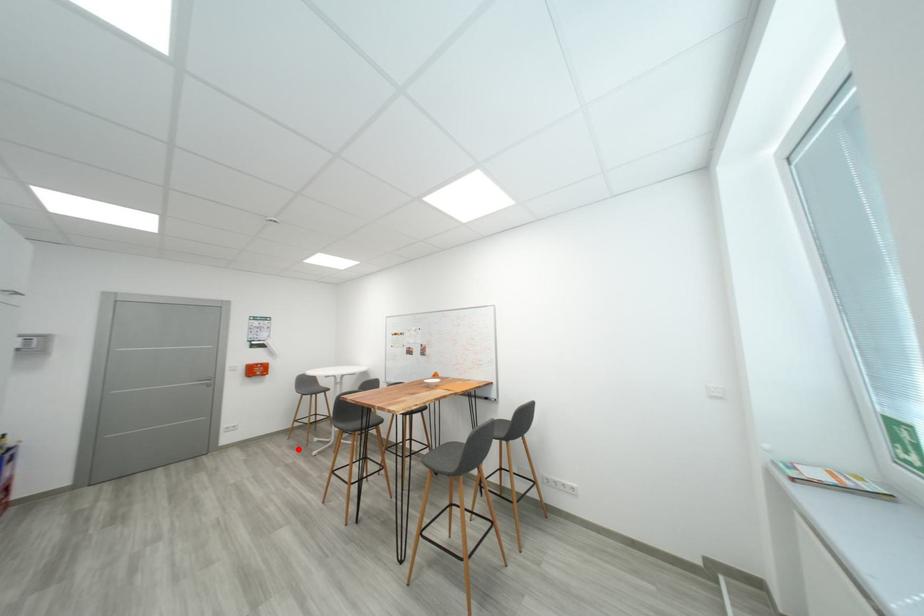
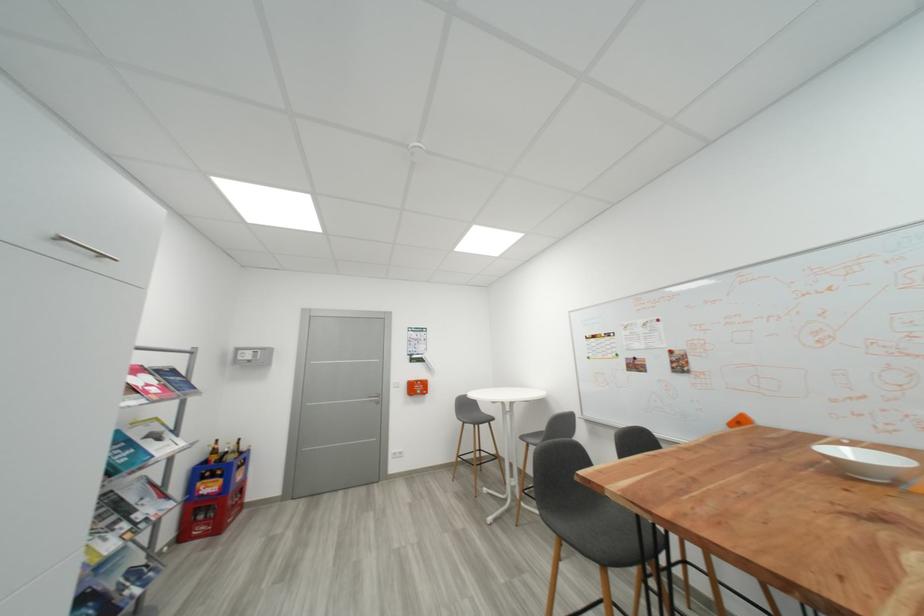
Find the pixel in the second image that matches the highlighted location in the first image.

(465, 496)